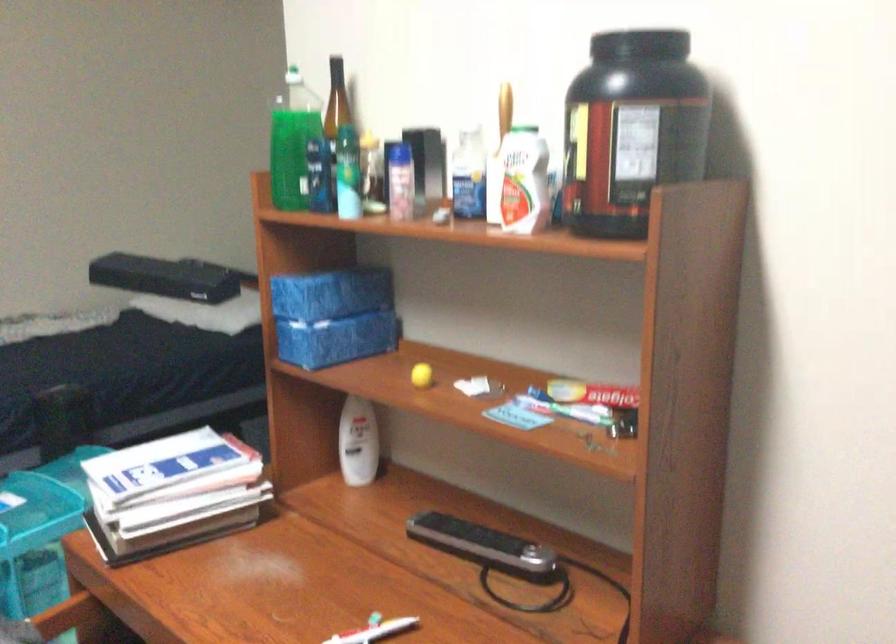
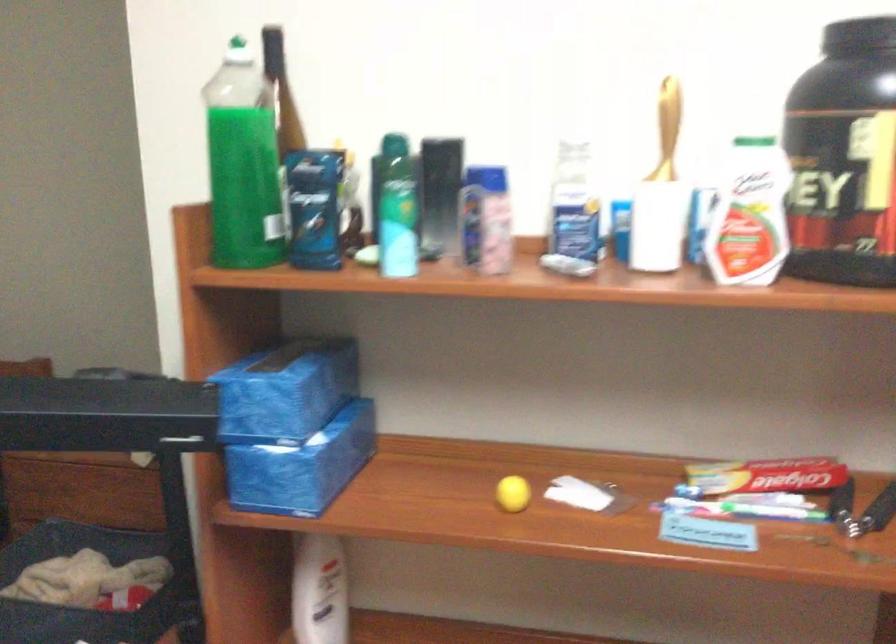
Locate, in the second image, the point that corresponds to (x=519, y=180) in the first image.

(748, 214)